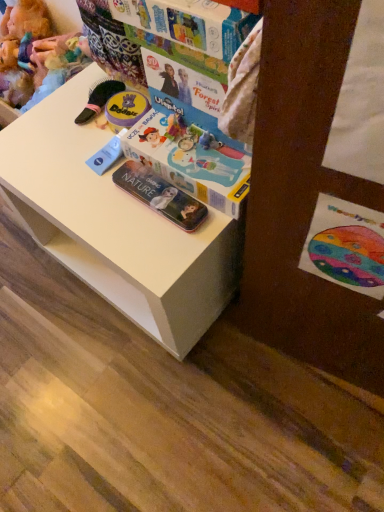
You are a GUI agent. You are given a task and a screenshot of the screen. Output one action in this format:
    pyautogui.click(x=<x>, y=<y>)
    Task: Click on the vacant space in front of transparent plastic case at lower center
    This screenshot has height=512, width=384.
    Given the screenshot: What is the action you would take?
    pyautogui.click(x=156, y=249)